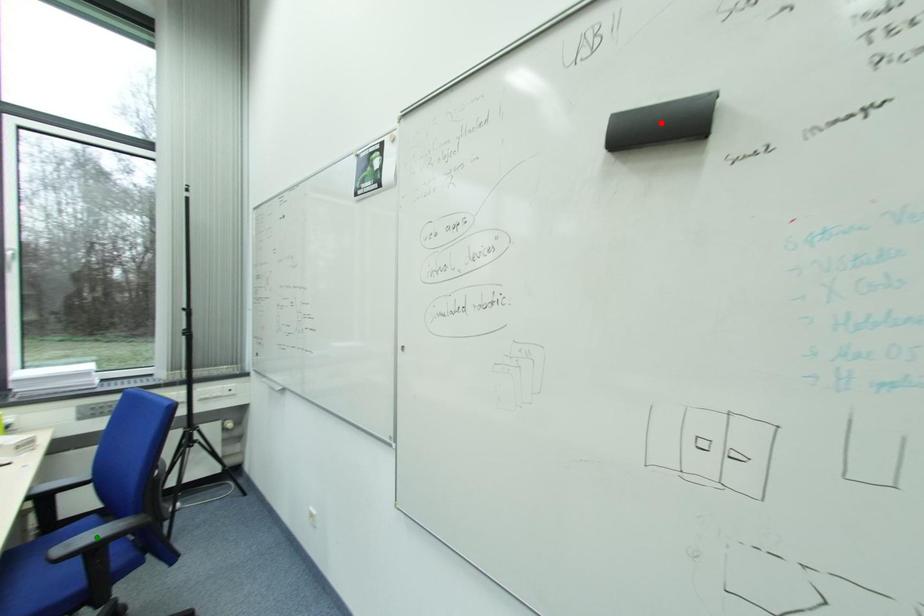
Order these from nearest to farthest:
red point, green point, yellow point

1. green point
2. yellow point
3. red point